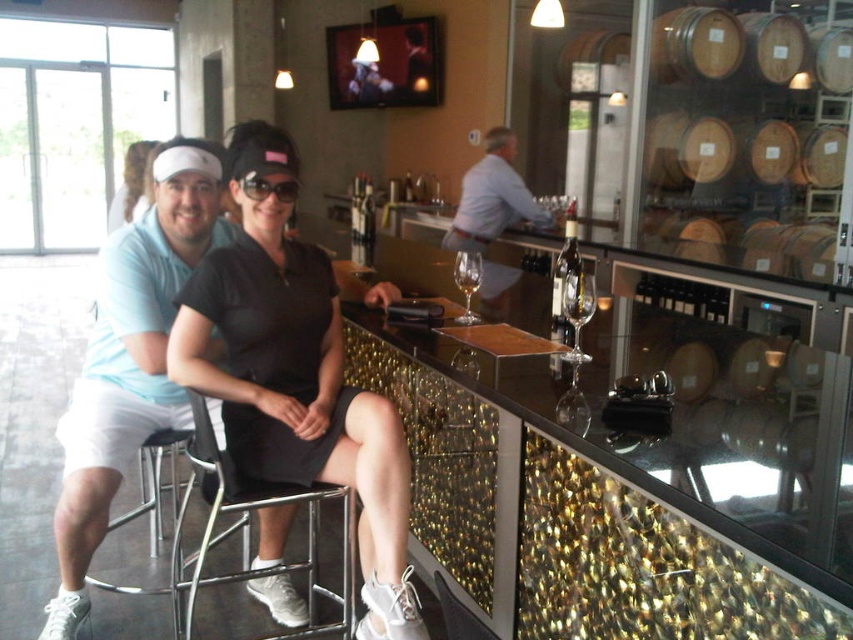
Question: Observing the image, what is the correct spatial positioning of light blue polo shirt at left in reference to clear glass wine at bar center?

Choices:
 (A) left
 (B) right

Answer: (A)

Question: Among these points, which one is farthest from the camera?

Choices:
 (A) (461, 269)
 (B) (463, 291)

Answer: (B)

Question: Does light blue shirt at center appear over clear glass wine glass at bar?

Choices:
 (A) yes
 (B) no

Answer: (A)

Question: Which object is the closest to the black plastic goggles at center?

Choices:
 (A) translucent glass bottle at center
 (B) light blue shirt at center

Answer: (A)

Question: Among these points, which one is farthest from the camera?

Choices:
 (A) (357, 438)
 (B) (554, 269)
 (C) (245, 188)

Answer: (B)

Question: In this image, where is translucent glass bottle at center located relative to clear glass wine at center?

Choices:
 (A) left
 (B) right

Answer: (B)